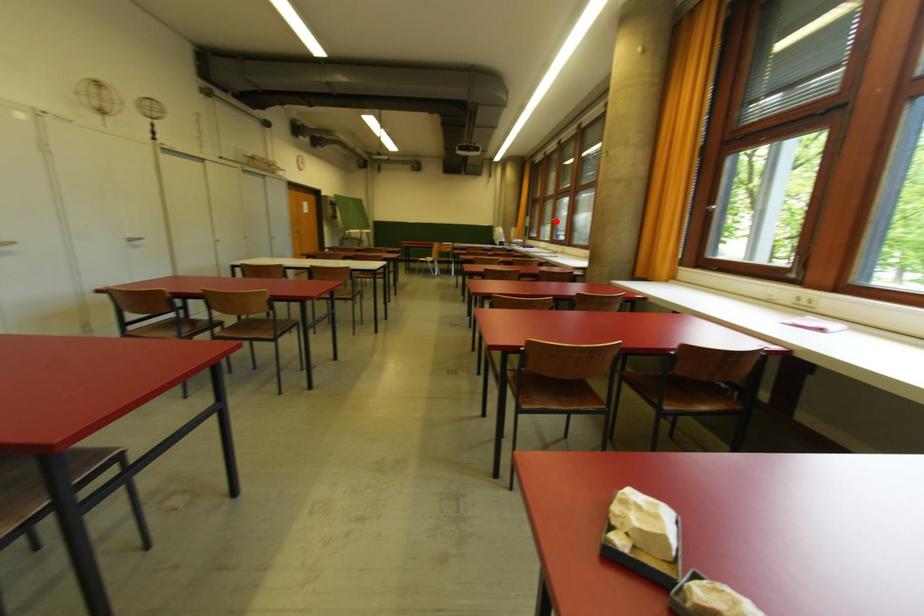
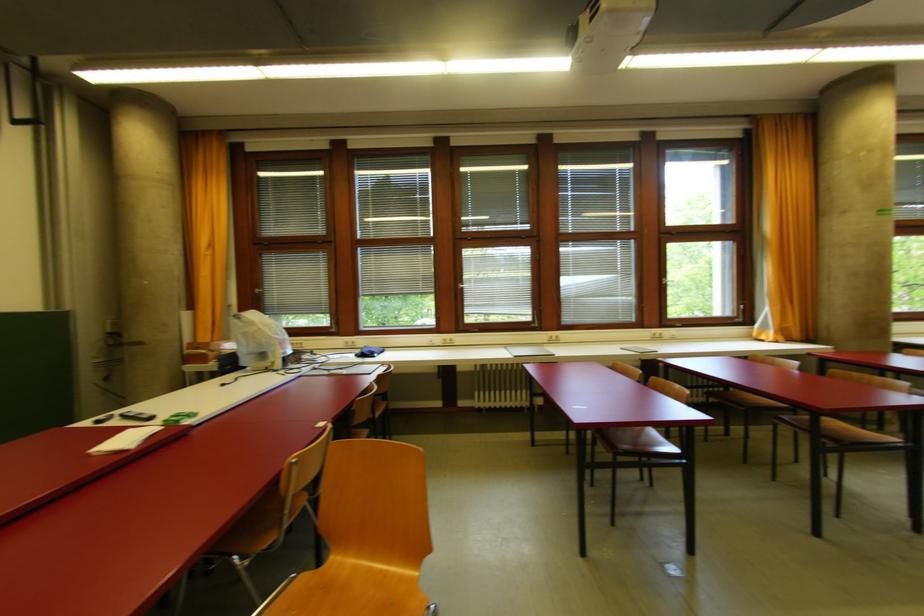
Find the pixel in the second image that matches the highlighted location in the first image.

(465, 288)